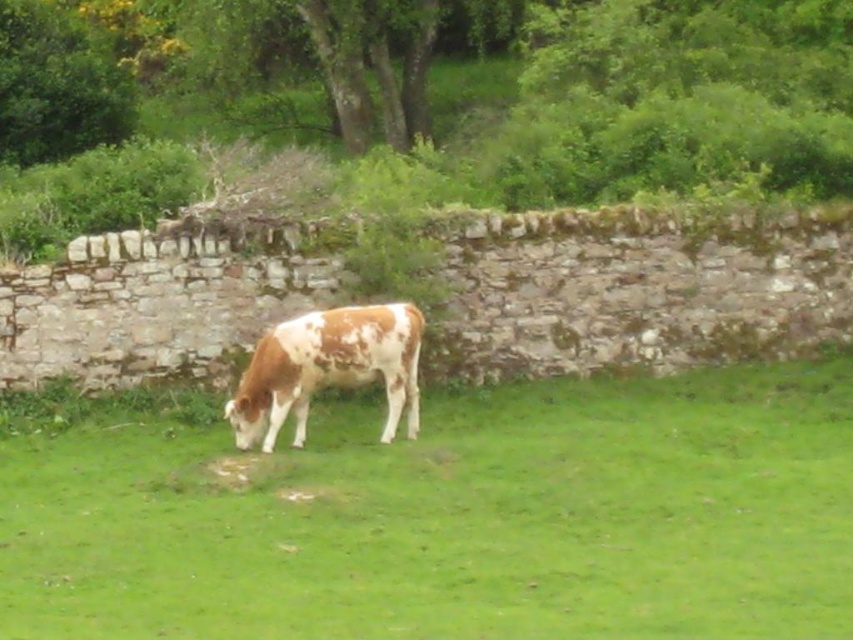
Measure the distance between brown speckled cow at center and speckled brown cow at center.

The distance of brown speckled cow at center from speckled brown cow at center is 4.59 meters.

Looking at this image, does brown speckled cow at center appear on the left side of speckled brown cow at center?

Incorrect, brown speckled cow at center is not on the left side of speckled brown cow at center.

Measure the distance between point (689, 518) and camera.

Point (689, 518) and camera are 37.30 feet apart.

Find the location of a particular element. The height and width of the screenshot is (640, 853). brown speckled cow at center is located at coordinates (440, 513).